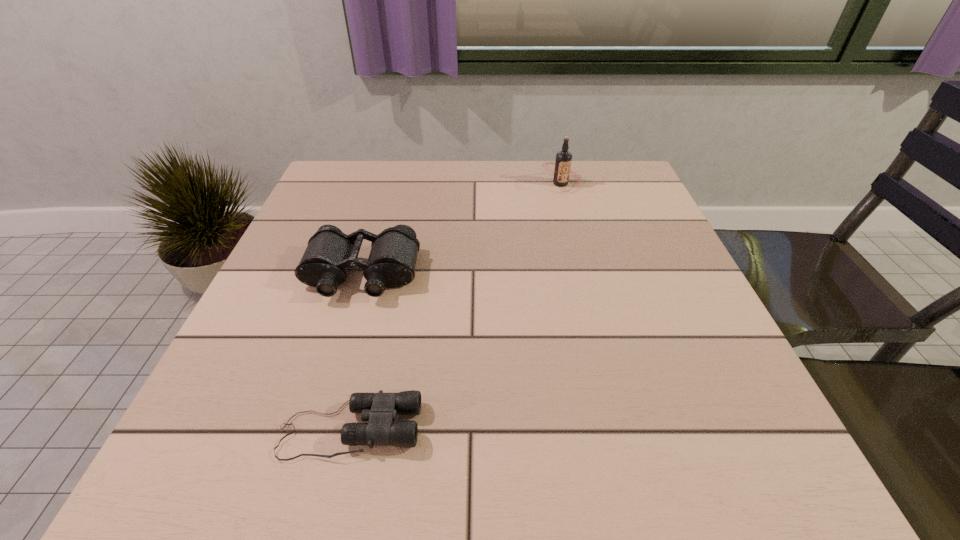
At what (x,y) coordinates should I click in order to perform the action: click on blank space that satisfies the following two spatial constraints: 1. on the label of the tallest object; 2. at the eyepiece of the shorter binoculars. Please return your answer as a coordinate pair (x, y). Looking at the image, I should click on (626, 429).